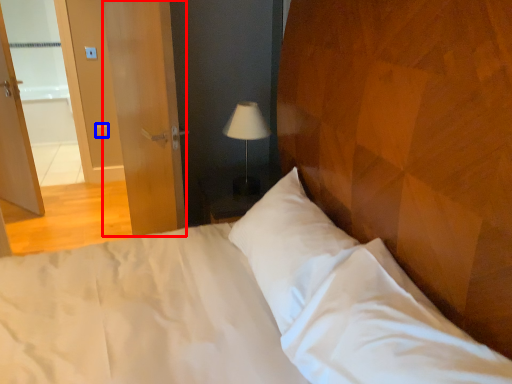
Question: Among these objects, which one is nearest to the camera, screen door (highlighted by a red box) or light switch (highlighted by a blue box)?

Choices:
 (A) screen door
 (B) light switch

Answer: (A)